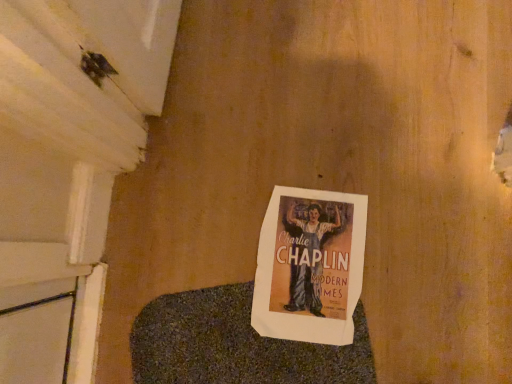
At what (x,y) coordinates should I click in order to perform the action: click on vacant area situated below matte paper poster at center (from a real-world perspective). Please return your answer as a coordinate pair (x, y). Looking at the image, I should click on (311, 238).